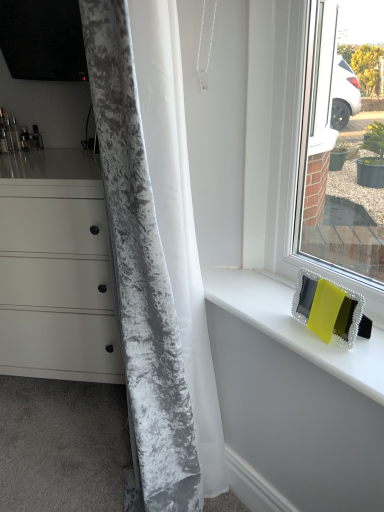
At what (x,y) coordinates should I click in order to perform the action: click on vacant space situated above yellow fabric at upper right (from a real-world perspective). Please return your answer as a coordinate pair (x, y). The width and height of the screenshot is (384, 512). Looking at the image, I should click on (278, 306).